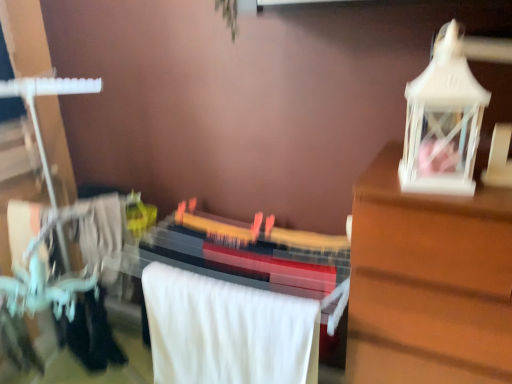
Question: From a real-world perspective, does matte black guitar at center stand above white plastic lantern at upper right?

Choices:
 (A) yes
 (B) no

Answer: (B)

Question: Does matte black guitar at center have a larger size compared to white plastic lantern at upper right?

Choices:
 (A) yes
 (B) no

Answer: (A)

Question: From the image's perspective, is matte black guitar at center below white plastic lantern at upper right?

Choices:
 (A) no
 (B) yes

Answer: (B)

Question: Considering the relative sizes of matte black guitar at center and white plastic lantern at upper right in the image provided, is matte black guitar at center shorter than white plastic lantern at upper right?

Choices:
 (A) no
 (B) yes

Answer: (A)

Question: Does matte black guitar at center turn towards white plastic lantern at upper right?

Choices:
 (A) yes
 (B) no

Answer: (B)

Question: Choose the correct answer: Is black fabric at lower left inside matte black guitar at center or outside it?

Choices:
 (A) inside
 (B) outside

Answer: (B)

Question: Looking at their shapes, would you say black fabric at lower left is wider or thinner than matte black guitar at center?

Choices:
 (A) wide
 (B) thin

Answer: (B)

Question: Is point (102, 299) closer or farther from the camera than point (98, 243)?

Choices:
 (A) farther
 (B) closer

Answer: (B)

Question: From the image's perspective, is black fabric at lower left above or below matte black guitar at center?

Choices:
 (A) above
 (B) below

Answer: (A)

Question: Looking at the image, does white plastic lantern at upper right seem bigger or smaller compared to black fabric at lower left?

Choices:
 (A) small
 (B) big

Answer: (B)

Question: From their relative heights in the image, would you say white plastic lantern at upper right is taller or shorter than black fabric at lower left?

Choices:
 (A) short
 (B) tall

Answer: (B)

Question: Is white plastic lantern at upper right in front of or behind black fabric at lower left in the image?

Choices:
 (A) front
 (B) behind

Answer: (A)

Question: From a real-world perspective, is white plastic lantern at upper right positioned above or below black fabric at lower left?

Choices:
 (A) below
 (B) above

Answer: (B)

Question: From the image's perspective, is matte black guitar at center positioned above or below black fabric at lower left?

Choices:
 (A) below
 (B) above

Answer: (A)

Question: Is point (259, 243) positioned closer to the camera than point (61, 340)?

Choices:
 (A) farther
 (B) closer

Answer: (A)